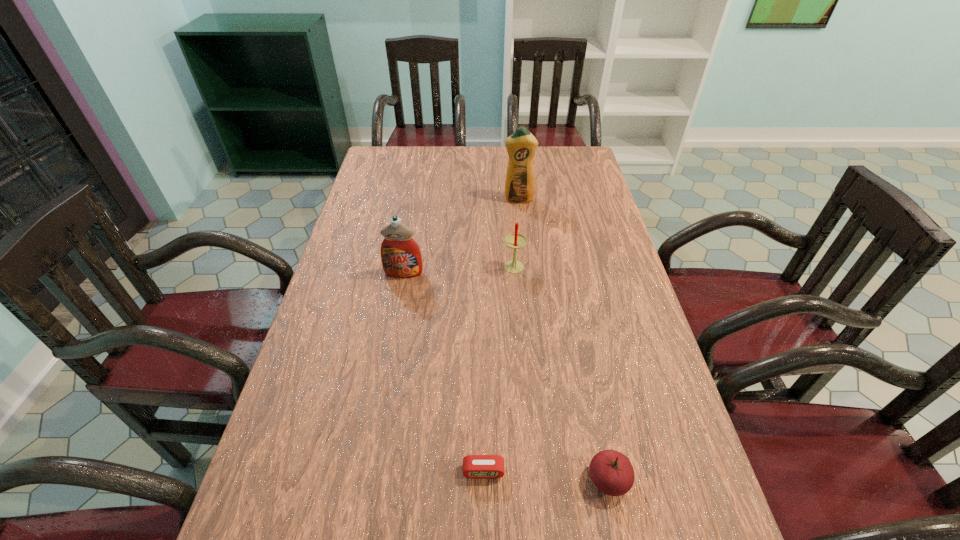
In the image, there is a desktop. Find the location of `vacant space at the far right corner`. vacant space at the far right corner is located at coordinates (549, 163).

The height and width of the screenshot is (540, 960). In order to click on free space between the shortest object and the farther detergent in this screenshot , I will do `click(501, 335)`.

This screenshot has height=540, width=960. I want to click on free space that is in between the third shortest object and the shorter detergent, so click(x=459, y=271).

In order to click on free space between the leftmost object and the alarm clock in this screenshot , I will do `click(444, 372)`.

This screenshot has height=540, width=960. Find the location of `free spot between the third tallest object and the second shortest object`. free spot between the third tallest object and the second shortest object is located at coordinates (562, 374).

Where is `unoccupied area between the fourth shortest object and the farther detergent`? The width and height of the screenshot is (960, 540). unoccupied area between the fourth shortest object and the farther detergent is located at coordinates (461, 236).

The height and width of the screenshot is (540, 960). What are the coordinates of `vacant space in between the alarm clock and the third shortest object` in the screenshot? It's located at [x=499, y=370].

The height and width of the screenshot is (540, 960). I want to click on empty location between the candle and the fourth object from right to left, so click(x=499, y=370).

Locate an element on the screen. This screenshot has width=960, height=540. vacant point located between the shortest object and the third shortest object is located at coordinates (499, 370).

Where is `free space that is in between the tomato and the left detergent`? free space that is in between the tomato and the left detergent is located at coordinates (506, 376).